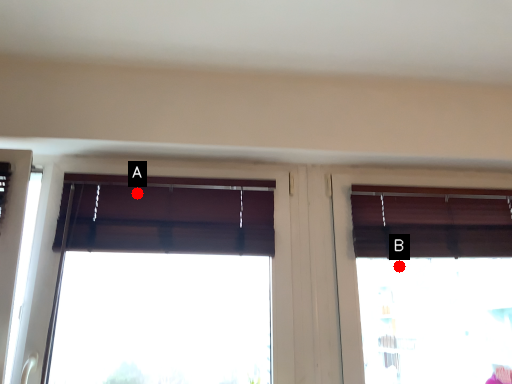
Question: Two points are circled on the image, labeled by A and B beside each circle. Which point is farther from the camera taking this photo?

Choices:
 (A) A is further
 (B) B is further

Answer: (B)